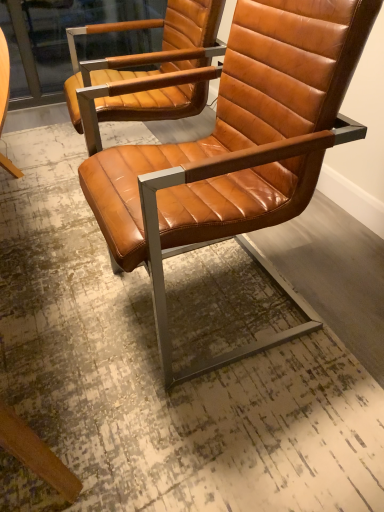
I want to click on free location in front of cognac leather chair at center, so click(x=214, y=434).